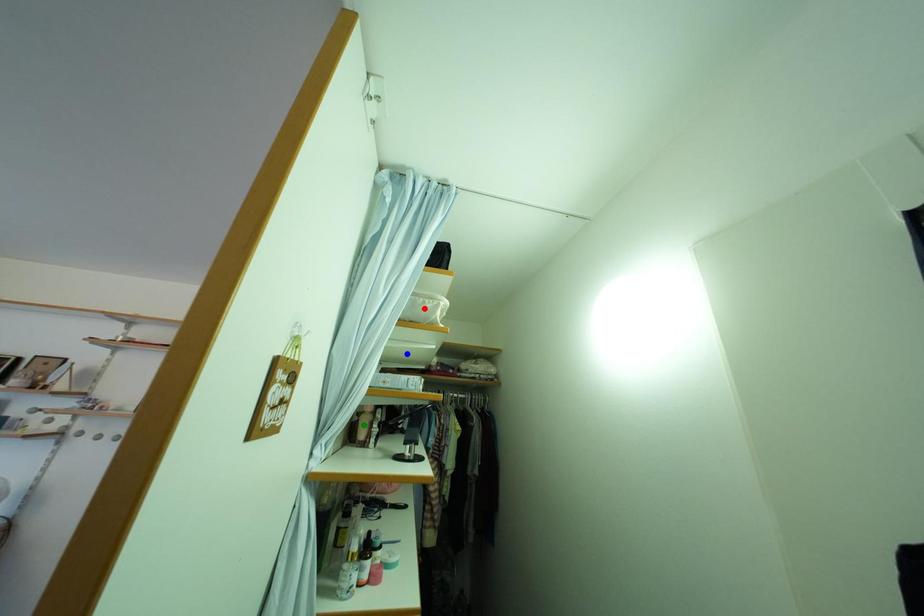
Order these from nearest to farthest:
green point, red point, blue point

red point
blue point
green point